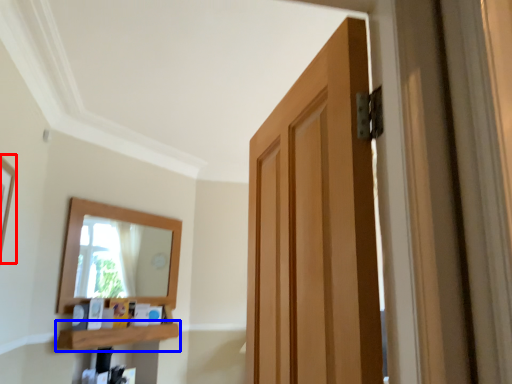
Question: Which of the following is the farthest to the observer, picture frame (highlighted by a red box) or shelf (highlighted by a blue box)?

Choices:
 (A) picture frame
 (B) shelf

Answer: (B)